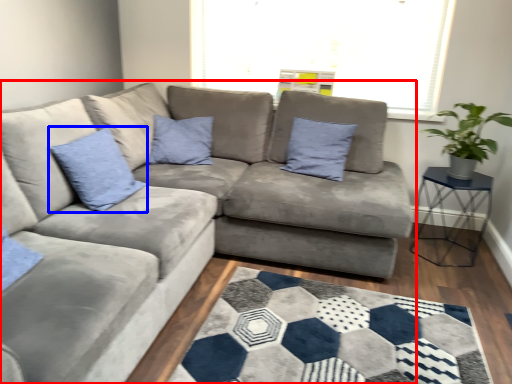
Question: Among these objects, which one is farthest to the camera, studio couch (highlighted by a red box) or pillow (highlighted by a blue box)?

Choices:
 (A) studio couch
 (B) pillow

Answer: (B)